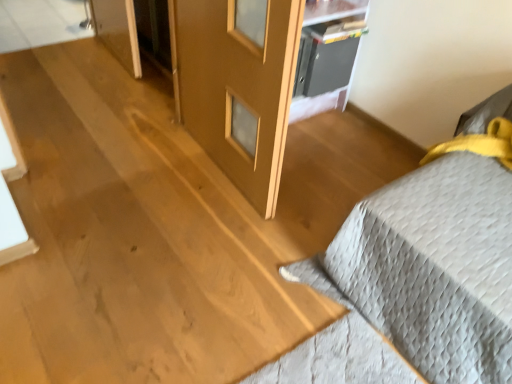
Image resolution: width=512 pixels, height=384 pixels. Find the location of `metallic gray cabinet at upper center`. metallic gray cabinet at upper center is located at coordinates (327, 55).

What do you see at coordinates (327, 55) in the screenshot?
I see `metallic gray cabinet at upper center` at bounding box center [327, 55].

What are the coordinates of `gray quilted bedspread at right` in the screenshot? It's located at (434, 258).

Identify the location of matte wood screen door at center. The height and width of the screenshot is (384, 512). (240, 86).

Which of these two, gray quilted bedspread at right or metallic gray cabinet at upper center, stands taller?

gray quilted bedspread at right.

Considering the positions of points (401, 225) and (349, 36), is point (401, 225) farther from camera compared to point (349, 36)?

No, it is in front of (349, 36).

Is gray quilted bedspread at right beside metallic gray cabinet at upper center?

There is a gap between gray quilted bedspread at right and metallic gray cabinet at upper center.

Can you confirm if gray quilted bedspread at right is positioned to the left of metallic gray cabinet at upper center?

Incorrect, gray quilted bedspread at right is not on the left side of metallic gray cabinet at upper center.

Would you say metallic gray cabinet at upper center is part of matte wood screen door at center's contents?

No, metallic gray cabinet at upper center is located outside of matte wood screen door at center.

Is matte wood screen door at center oriented away from metallic gray cabinet at upper center?

That's right, matte wood screen door at center is facing away from metallic gray cabinet at upper center.

Considering the relative sizes of matte wood screen door at center and metallic gray cabinet at upper center in the image provided, is matte wood screen door at center bigger than metallic gray cabinet at upper center?

Correct, matte wood screen door at center is larger in size than metallic gray cabinet at upper center.

In terms of width, does matte wood screen door at center look wider or thinner when compared to metallic gray cabinet at upper center?

Clearly, matte wood screen door at center has less width compared to metallic gray cabinet at upper center.

Can you confirm if matte wood screen door at center is wider than gray quilted bedspread at right?

No.

How far apart are matte wood screen door at center and gray quilted bedspread at right?

They are 27.49 inches apart.

Looking at this image, is matte wood screen door at center at the right side of gray quilted bedspread at right?

Incorrect, matte wood screen door at center is not on the right side of gray quilted bedspread at right.

Is matte wood screen door at center facing towards gray quilted bedspread at right?

No, matte wood screen door at center is not turned towards gray quilted bedspread at right.

Would you say metallic gray cabinet at upper center is outside gray quilted bedspread at right?

Yes, metallic gray cabinet at upper center is located beyond the bounds of gray quilted bedspread at right.

From the image's perspective, is metallic gray cabinet at upper center on gray quilted bedspread at right?

Yes.

From a real-world perspective, which object stands above the other?

gray quilted bedspread at right is physically above.

Where is `furniture on the right of metallic gray cabinet at upper center`? The image size is (512, 384). furniture on the right of metallic gray cabinet at upper center is located at coordinates (434, 258).

Between metallic gray cabinet at upper center and matte wood screen door at center, which one has larger width?

metallic gray cabinet at upper center.

Can you tell me how much metallic gray cabinet at upper center and matte wood screen door at center differ in facing direction?

88.3 degrees.

Where is `screen door in front of the metallic gray cabinet at upper center`? This screenshot has width=512, height=384. screen door in front of the metallic gray cabinet at upper center is located at coordinates (240, 86).

From a real-world perspective, is gray quilted bedspread at right positioned under matte wood screen door at center based on gravity?

Yes, from a real-world perspective, gray quilted bedspread at right is beneath matte wood screen door at center.

Can you confirm if gray quilted bedspread at right is positioned to the right of matte wood screen door at center?

Yes.

Is point (502, 293) positioned before point (298, 2)?

Yes, point (502, 293) is in front of point (298, 2).

Can you tell me how much gray quilted bedspread at right and matte wood screen door at center differ in facing direction?

The angular difference between gray quilted bedspread at right and matte wood screen door at center is 0.000966 degrees.

You are a GUI agent. You are given a task and a screenshot of the screen. Output one action in this format:
    pyautogui.click(x=<x>, y=<y>)
    Task: Click on the shelf below the gray quilted bedspread at right (from a real-world perspective)
    
    Given the screenshot: What is the action you would take?
    pyautogui.click(x=327, y=55)

In order to click on screen door in front of the metallic gray cabinet at upper center in this screenshot , I will do `click(240, 86)`.

Which object lies nearer to the anchor point metallic gray cabinet at upper center, matte wood screen door at center or gray quilted bedspread at right?

matte wood screen door at center is positioned closer to the anchor metallic gray cabinet at upper center.

When comparing their distances from gray quilted bedspread at right, does matte wood screen door at center or metallic gray cabinet at upper center seem further?

Among the two, metallic gray cabinet at upper center is located further to gray quilted bedspread at right.

Considering their positions, is metallic gray cabinet at upper center positioned further to matte wood screen door at center than gray quilted bedspread at right?

The object further to matte wood screen door at center is gray quilted bedspread at right.

Based on their spatial positions, is metallic gray cabinet at upper center or matte wood screen door at center closer to gray quilted bedspread at right?

Among the two, matte wood screen door at center is located nearer to gray quilted bedspread at right.

Estimate the real-world distances between objects in this image. Which object is closer to matte wood screen door at center, gray quilted bedspread at right or metallic gray cabinet at upper center?

metallic gray cabinet at upper center is closer to matte wood screen door at center.

When comparing their distances from metallic gray cabinet at upper center, does gray quilted bedspread at right or matte wood screen door at center seem closer?

matte wood screen door at center is positioned closer to the anchor metallic gray cabinet at upper center.

Where is `screen door located between gray quilted bedspread at right and metallic gray cabinet at upper center in the depth direction`? Image resolution: width=512 pixels, height=384 pixels. screen door located between gray quilted bedspread at right and metallic gray cabinet at upper center in the depth direction is located at coordinates (240, 86).